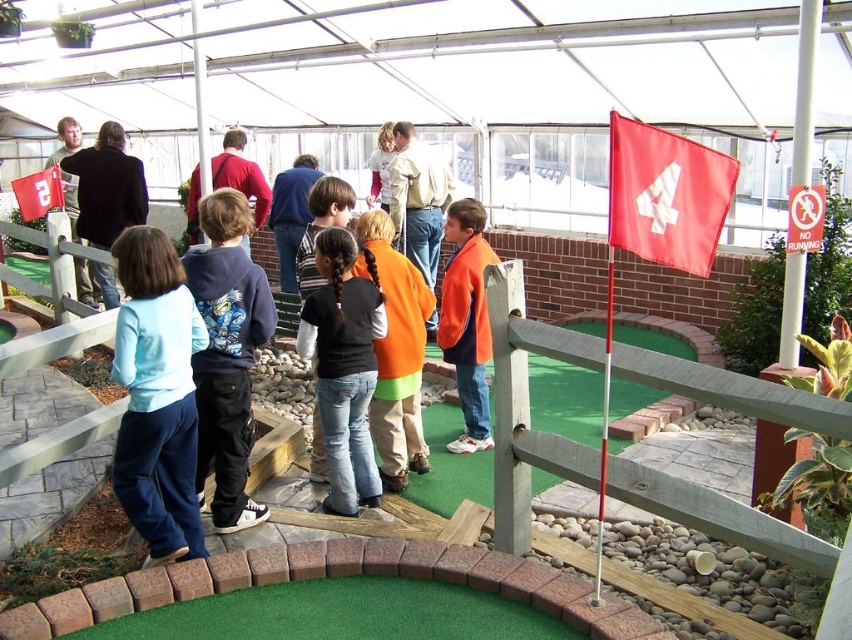
Question: Which of these objects is positioned farthest from the matte black jacket at upper left?

Choices:
 (A) orange fleece jacket at center
 (B) red fabric flag at upper left

Answer: (A)

Question: Is light blue fleece at center above orange fleece jacket at center?

Choices:
 (A) yes
 (B) no

Answer: (B)

Question: Which point appears farthest from the camera in this image?

Choices:
 (A) (153, 433)
 (B) (101, 204)
 (C) (246, 416)
 (D) (383, 328)

Answer: (B)

Question: Is dark blue hoodie at center positioned in front of red fabric flag at upper left?

Choices:
 (A) no
 (B) yes

Answer: (B)

Question: Which point is farther from the camera taking this photo?

Choices:
 (A) (136, 467)
 (B) (245, 429)
 (C) (456, 451)

Answer: (C)

Question: Can you confirm if orange fleece jacket at center is thinner than matte black jacket at upper left?

Choices:
 (A) no
 (B) yes

Answer: (B)